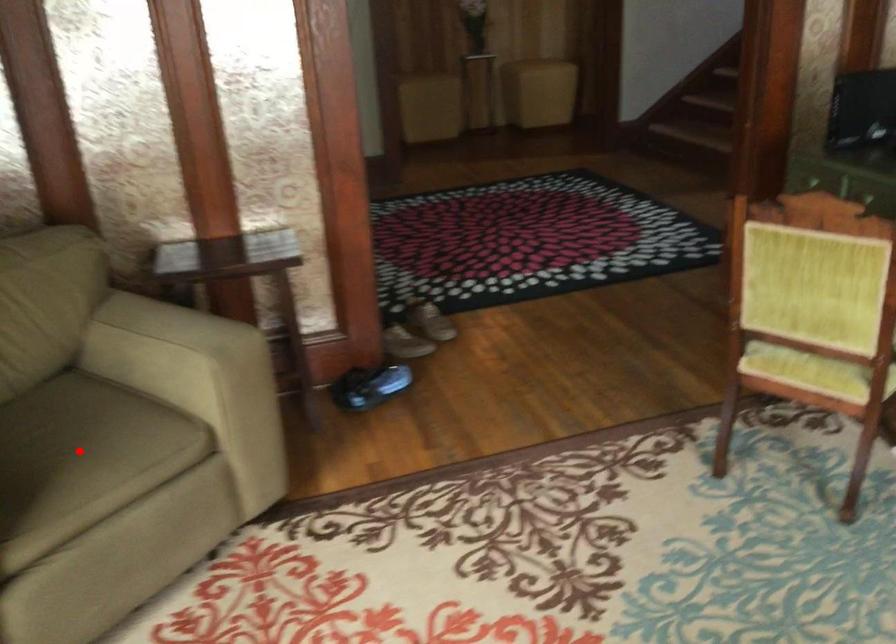
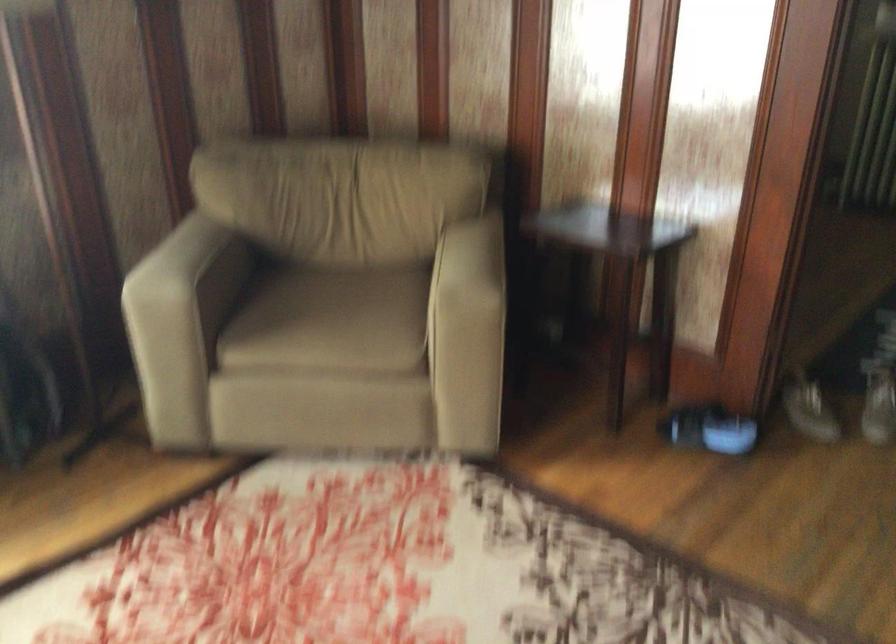
In the second image, find the point that corresponds to the highlighted location in the first image.

(331, 321)